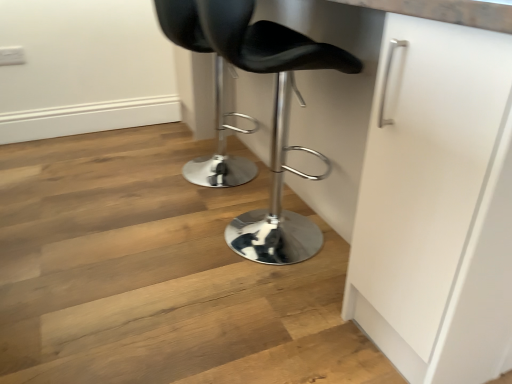
Where is `free region on the left part of black leather stool at center, the first chair in the front-to-back sequence`? free region on the left part of black leather stool at center, the first chair in the front-to-back sequence is located at coordinates (145, 242).